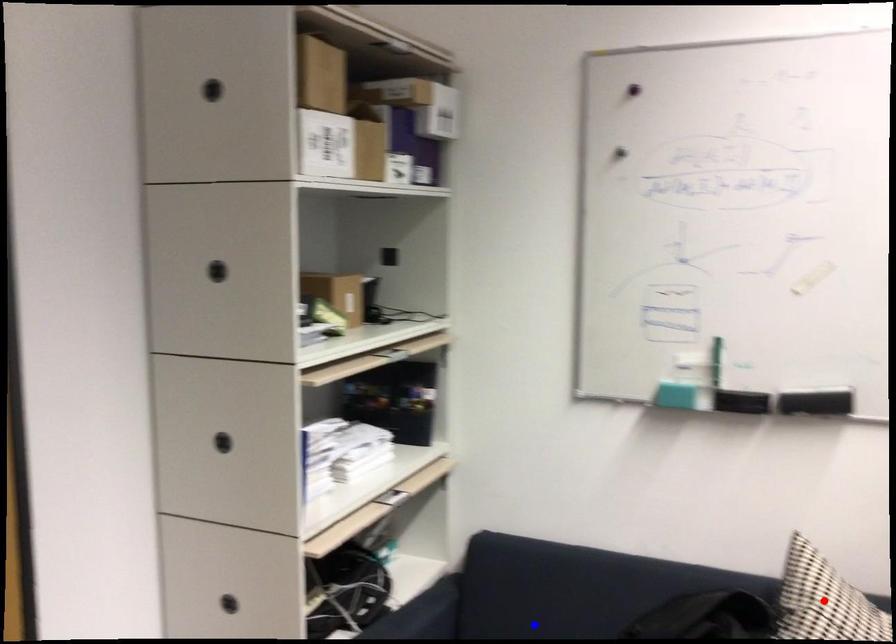
Question: In the image, two points are highlighted. Which point is nearer to the camera? Reply with the corresponding letter.

Choices:
 (A) blue point
 (B) red point

Answer: (B)